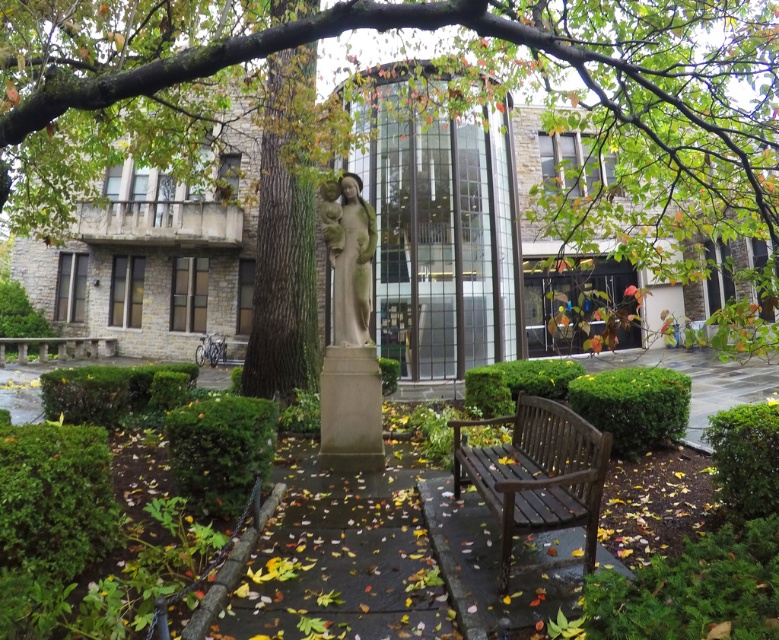
Can you confirm if dark brown wooden bench at lower right is bigger than stone statue at center?

Yes, dark brown wooden bench at lower right is bigger than stone statue at center.

Is point (590, 541) more distant than point (333, 192)?

No, (590, 541) is in front of (333, 192).

Identify the location of dark brown wooden bench at lower right. The width and height of the screenshot is (779, 640). (536, 474).

Is green leafy tree at center below stone statue at center?

No.

Describe the element at coordinates (439, 96) in the screenshot. I see `green leafy tree at center` at that location.

Find the location of `green leafy tree at center`. green leafy tree at center is located at coordinates (439, 96).

Is green leafy tree at center further to camera compared to dark brown wooden bench at lower right?

That is False.

Is green leafy tree at center bigger than dark brown wooden bench at lower right?

Indeed, green leafy tree at center has a larger size compared to dark brown wooden bench at lower right.

Between point (37, 120) and point (545, 449), which one is positioned behind?

Positioned behind is point (545, 449).

Find the location of a particular element. green leafy tree at center is located at coordinates (439, 96).